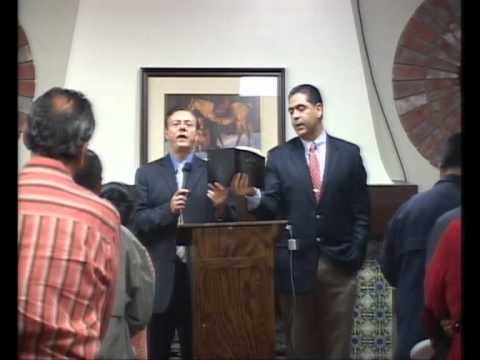
Locate an element on the screen. Image resolution: width=480 pixels, height=360 pixels. cord is located at coordinates (293, 245).